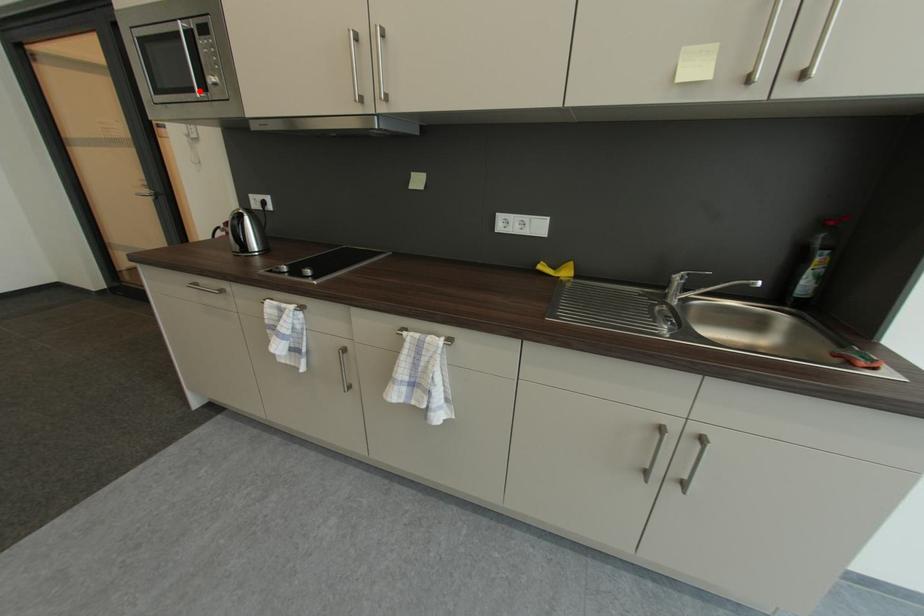
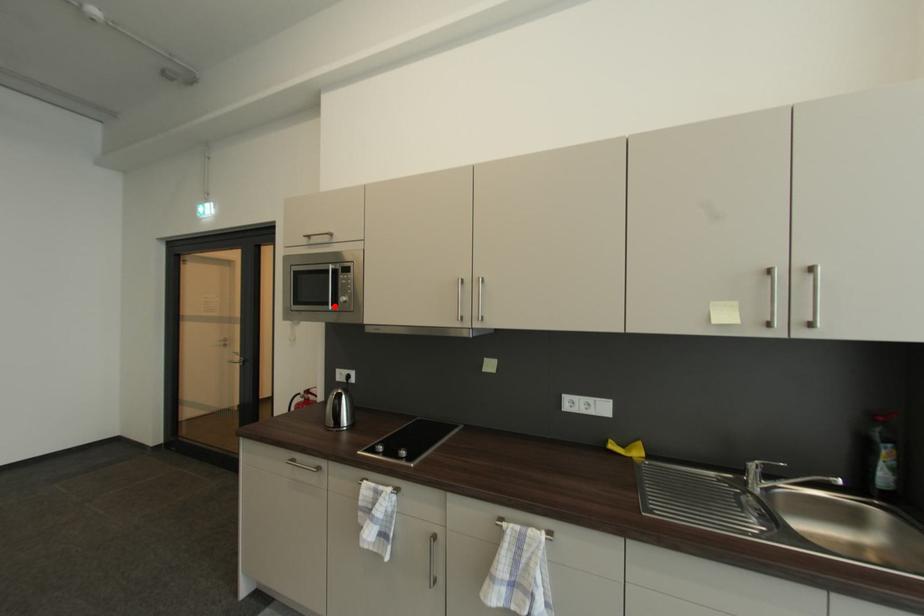
I am providing you with two images of the same scene from different viewpoints. A red point is marked on the first image and another point is marked on the second image. Is the marked point in image1 the same physical position as the marked point in image2?

Yes